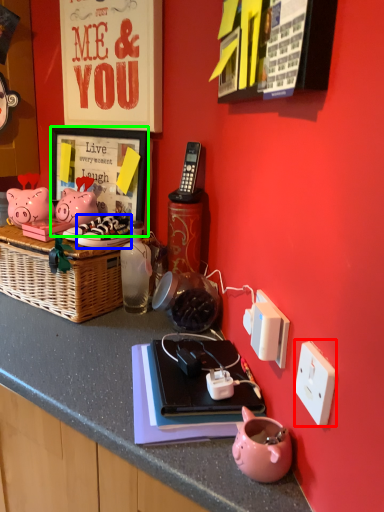
Question: Which object is positioned farthest from power outlet (highlighted by a red box)? Select from footwear (highlighted by a blue box) and picture frame (highlighted by a green box).

Choices:
 (A) footwear
 (B) picture frame

Answer: (B)